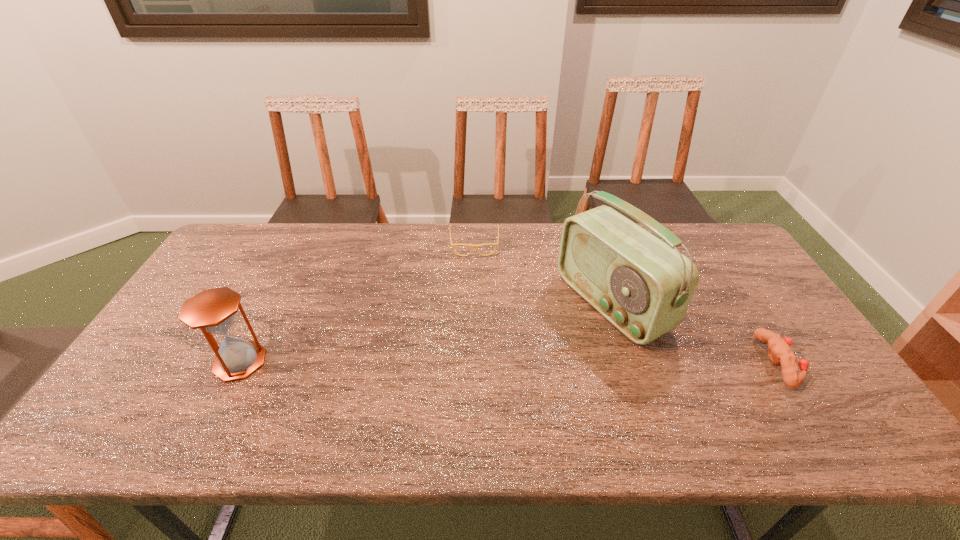
Locate an element on the screen. vacant space that satisfies the following two spatial constraints: 1. on the front side of the third object from right to left; 2. with the gloves of the puncher facing forward is located at coordinates (472, 362).

Find the location of a particular element. The height and width of the screenshot is (540, 960). free space that satisfies the following two spatial constraints: 1. on the front side of the rightmost object; 2. with the gloves of the tallest object facing forward is located at coordinates (631, 362).

Locate an element on the screen. This screenshot has width=960, height=540. free spot that satisfies the following two spatial constraints: 1. on the front side of the third object from left to right; 2. with the gloves of the second shortest object facing forward is located at coordinates (631, 362).

Locate an element on the screen. free space that satisfies the following two spatial constraints: 1. on the front side of the puncher; 2. with the gloves of the shortest object facing forward is located at coordinates 472,362.